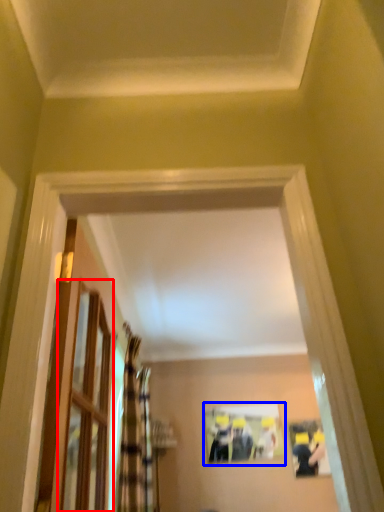
Question: Which object is closer to the camera taking this photo, glass door (highlighted by a red box) or picture frame (highlighted by a blue box)?

Choices:
 (A) glass door
 (B) picture frame

Answer: (A)